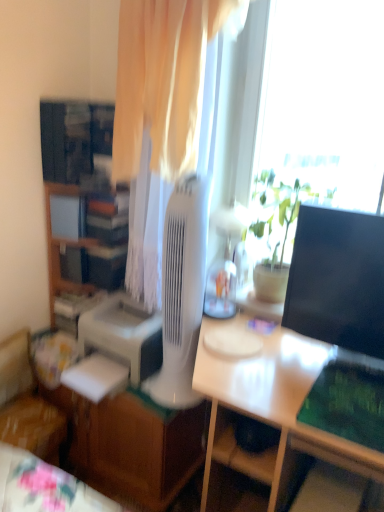
Question: Does black glossy monitor at right have a lesser height compared to white plastic mechanical fan at center?

Choices:
 (A) no
 (B) yes

Answer: (B)

Question: Would you say black glossy monitor at right is outside white plastic mechanical fan at center?

Choices:
 (A) yes
 (B) no

Answer: (A)

Question: Can you confirm if black glossy monitor at right is smaller than white plastic mechanical fan at center?

Choices:
 (A) no
 (B) yes

Answer: (B)

Question: From the image's perspective, is black glossy monitor at right under white plastic mechanical fan at center?

Choices:
 (A) no
 (B) yes

Answer: (A)

Question: Does black glossy monitor at right turn towards white plastic mechanical fan at center?

Choices:
 (A) yes
 (B) no

Answer: (B)

Question: Can you confirm if black glossy monitor at right is positioned to the left of white plastic mechanical fan at center?

Choices:
 (A) yes
 (B) no

Answer: (B)

Question: From a real-world perspective, is white plastic mechanical fan at center over green matte plant at center?

Choices:
 (A) no
 (B) yes

Answer: (A)

Question: From the image's perspective, would you say white plastic mechanical fan at center is shown under green matte plant at center?

Choices:
 (A) no
 (B) yes

Answer: (B)

Question: From a real-world perspective, does white plastic mechanical fan at center sit lower than green matte plant at center?

Choices:
 (A) no
 (B) yes

Answer: (B)

Question: Does white plastic mechanical fan at center have a lesser width compared to green matte plant at center?

Choices:
 (A) yes
 (B) no

Answer: (A)

Question: Is white plastic mechanical fan at center positioned beyond the bounds of green matte plant at center?

Choices:
 (A) yes
 (B) no

Answer: (A)

Question: Can you see white plastic mechanical fan at center touching green matte plant at center?

Choices:
 (A) no
 (B) yes

Answer: (A)

Question: Can you see wooden fabric chair at lower left touching green matte plant at center?

Choices:
 (A) no
 (B) yes

Answer: (A)